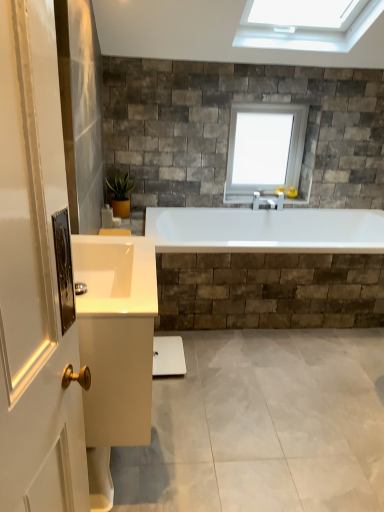
Question: Is green matte plant at upper left thinner than white glass window at upper center?

Choices:
 (A) no
 (B) yes

Answer: (A)

Question: Is green matte plant at upper left located outside white glass window at upper center?

Choices:
 (A) no
 (B) yes

Answer: (B)

Question: Can you confirm if green matte plant at upper left is smaller than white glass window at upper center?

Choices:
 (A) no
 (B) yes

Answer: (B)

Question: Does green matte plant at upper left have a lesser height compared to white glass window at upper center?

Choices:
 (A) no
 (B) yes

Answer: (B)

Question: Is green matte plant at upper left oriented away from white glass window at upper center?

Choices:
 (A) yes
 (B) no

Answer: (B)

Question: From a real-world perspective, is green matte plant at upper left over white glass window at upper center?

Choices:
 (A) yes
 (B) no

Answer: (B)

Question: Is the position of white glossy cabinet at lower left less distant than that of white glossy sink at lower left?

Choices:
 (A) no
 (B) yes

Answer: (A)

Question: Can you confirm if white glossy cabinet at lower left is smaller than white glossy sink at lower left?

Choices:
 (A) yes
 (B) no

Answer: (B)

Question: Does white glossy cabinet at lower left have a greater width compared to white glossy sink at lower left?

Choices:
 (A) yes
 (B) no

Answer: (A)

Question: Are white glossy cabinet at lower left and white glossy sink at lower left located far from each other?

Choices:
 (A) no
 (B) yes

Answer: (A)

Question: Could you tell me if white glossy cabinet at lower left is turned towards white glossy sink at lower left?

Choices:
 (A) yes
 (B) no

Answer: (B)

Question: Is white glossy sink at lower left a part of white glossy cabinet at lower left?

Choices:
 (A) no
 (B) yes

Answer: (B)

Question: Can you confirm if white glossy cabinet at lower left is positioned to the right of white glass window at upper center?

Choices:
 (A) yes
 (B) no

Answer: (B)